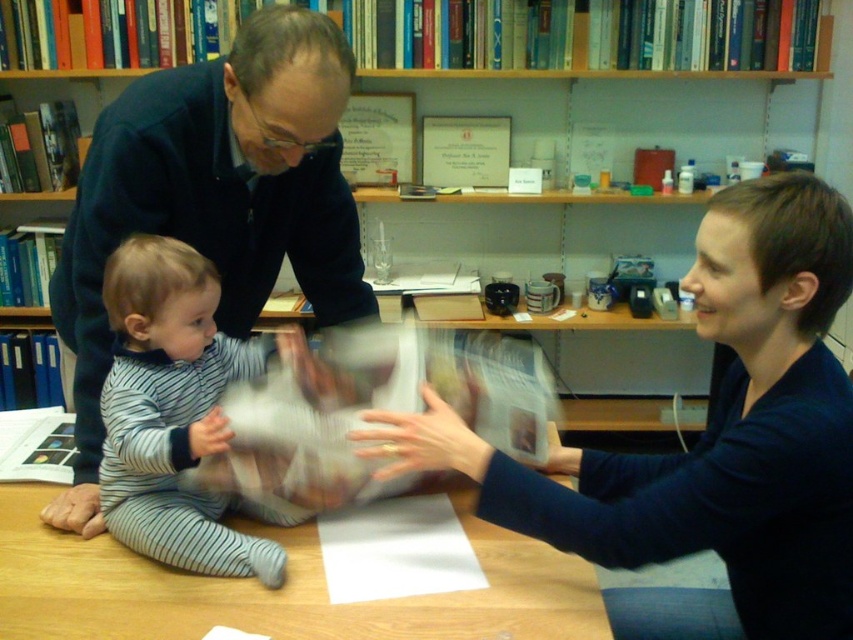
Question: Can you confirm if smooth blue sweater at center is positioned below dark blue sweater at center?

Choices:
 (A) yes
 (B) no

Answer: (A)

Question: Among these points, which one is nearest to the camera?

Choices:
 (A) (256, 136)
 (B) (207, 579)
 (C) (842, 589)

Answer: (C)

Question: Considering the real-world distances, which object is closest to the wooden table at center?

Choices:
 (A) dark blue sweater at center
 (B) wooden bookshelf at upper center

Answer: (A)

Question: Which point is farther from the camera taking this photo?

Choices:
 (A) (68, 269)
 (B) (726, 512)

Answer: (A)

Question: Is dark blue sweater at center thinner than striped cotton onesie at center?

Choices:
 (A) yes
 (B) no

Answer: (B)

Question: Is wooden bookshelf at upper center closer to camera compared to dark blue sweater at center?

Choices:
 (A) no
 (B) yes

Answer: (A)